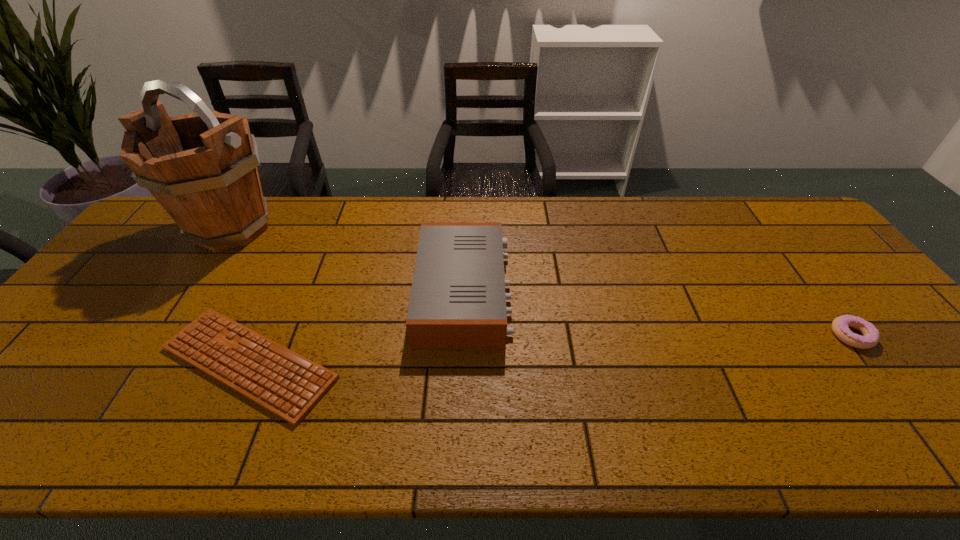
This screenshot has height=540, width=960. In order to click on object located in the far edge section of the desktop in this screenshot , I will do `click(202, 168)`.

In order to click on object that is at the near edge in this screenshot , I will do `click(289, 385)`.

Locate an element on the screen. Image resolution: width=960 pixels, height=540 pixels. object that is at the left edge is located at coordinates (202, 168).

The width and height of the screenshot is (960, 540). I want to click on object positioned at the right edge, so click(840, 326).

Locate an element on the screen. This screenshot has height=540, width=960. object present at the far left corner is located at coordinates (202, 168).

In order to click on vacant space at the far edge of the desktop in this screenshot , I will do `click(737, 206)`.

Where is `blank space at the near edge of the desktop`? This screenshot has width=960, height=540. blank space at the near edge of the desktop is located at coordinates (362, 443).

In the image, there is a desktop. Find the location of `vacant space at the left edge`. vacant space at the left edge is located at coordinates (122, 278).

Image resolution: width=960 pixels, height=540 pixels. In order to click on free region at the right edge of the desktop in this screenshot , I will do `click(855, 278)`.

Identify the location of vacant region between the computer keyboard and the tallest object. The height and width of the screenshot is (540, 960). [241, 295].